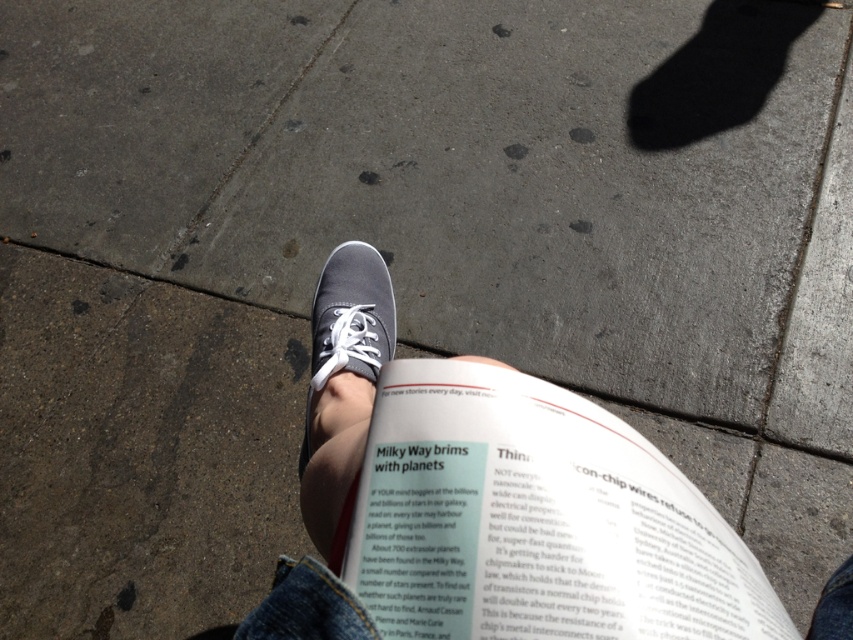
You are trying to place a new bookmark between the white paper at center and the matte gray sneaker at center. Which object should you place it closer to if you want the bookmark to be near the smaller item?

The white paper at center is smaller than the matte gray sneaker at center, so you should place the bookmark closer to the white paper at center.

You are a person sitting on a sidewalk holding a book on your lap. You want to place a white paper at center on the ground next to your matte gray sneaker at center. Can you place it to the right of the sneaker?

The white paper at center is positioned on the right side of matte gray sneaker at center, so yes, you can place it to the right of the sneaker.